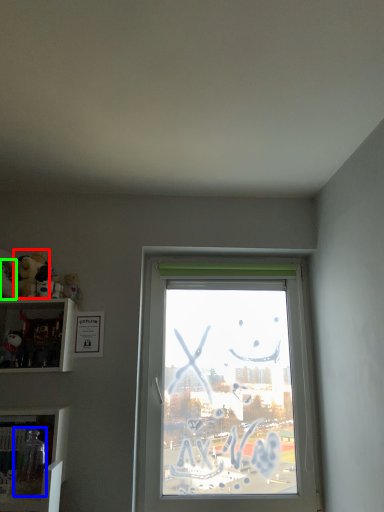
Question: Which object is the closest to the toy (highlighted by a red box)? Choose among these: toy (highlighted by a blue box) or toy (highlighted by a green box).

Choices:
 (A) toy
 (B) toy

Answer: (B)